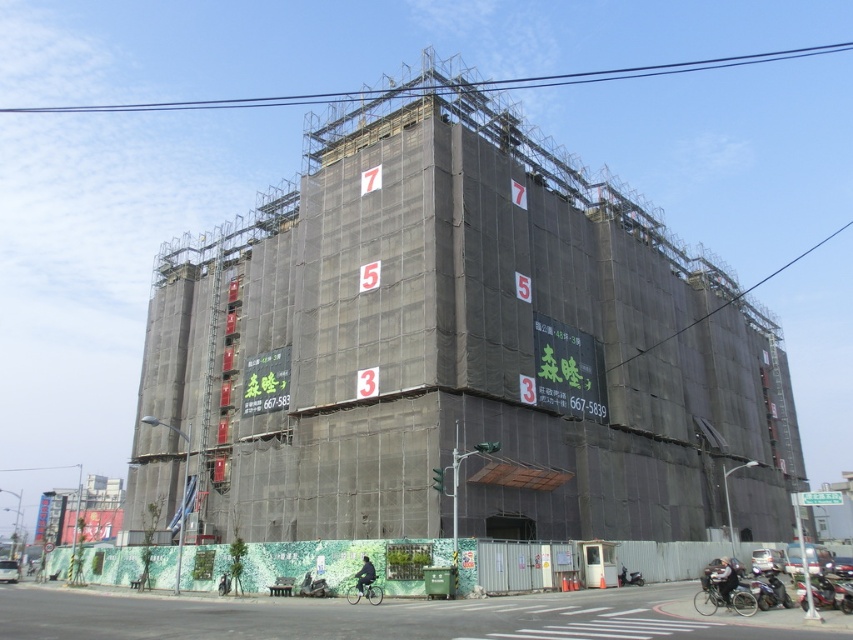
Which of these two, black fabric scaffolding at center or green textured wall at lower center, stands taller?

black fabric scaffolding at center is taller.

Which is below, black fabric scaffolding at center or green textured wall at lower center?

green textured wall at lower center is below.

Is point (299, 356) in front of point (221, 612)?

No, it is behind (221, 612).

I want to click on black fabric scaffolding at center, so click(462, 344).